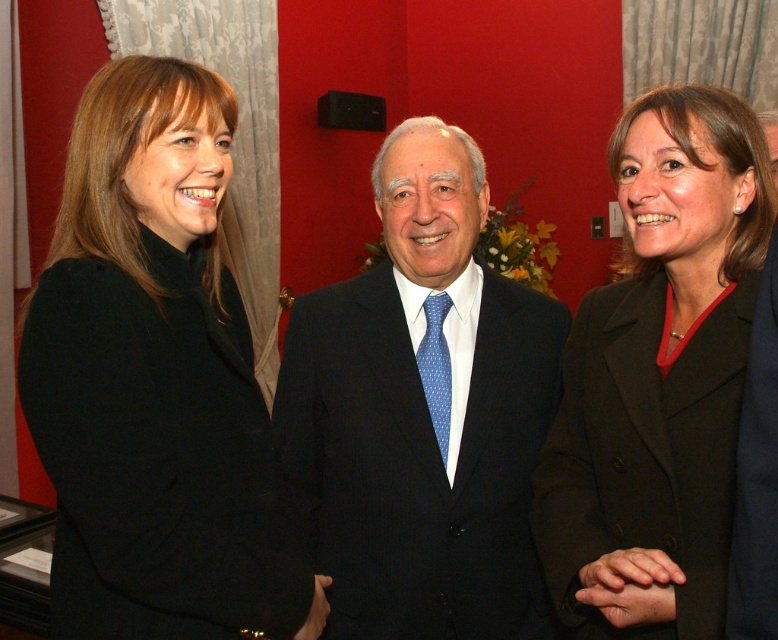
Question: Which of the following is the farthest from the observer?

Choices:
 (A) (757, 504)
 (B) (664, 600)
 (C) (72, 406)
 (D) (477, 548)

Answer: (D)

Question: Does matte black blazer at center have a smaller size compared to blue dotted silk tie at center?

Choices:
 (A) yes
 (B) no

Answer: (B)

Question: Is matte black blazer at center above black silk suit at center?

Choices:
 (A) no
 (B) yes

Answer: (B)

Question: Considering the real-world distances, which object is farthest from the black woolen coat at left?

Choices:
 (A) matte black blazer at center
 (B) black silk suit at center

Answer: (B)

Question: Considering the real-world distances, which object is closest to the black woolen coat at left?

Choices:
 (A) blue dotted silk tie at center
 (B) black silk suit at center
 (C) matte black blazer at center
 (D) black suit at center

Answer: (D)

Question: Does matte black blazer at center have a lesser width compared to black silk suit at center?

Choices:
 (A) no
 (B) yes

Answer: (A)